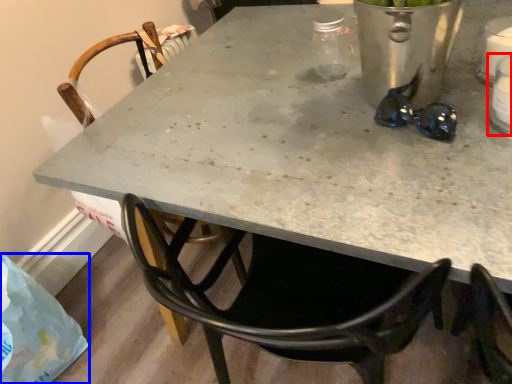
Question: Which of the following is the farthest to the observer, appliance (highlighted by a red box) or plastic bag (highlighted by a blue box)?

Choices:
 (A) appliance
 (B) plastic bag

Answer: (B)